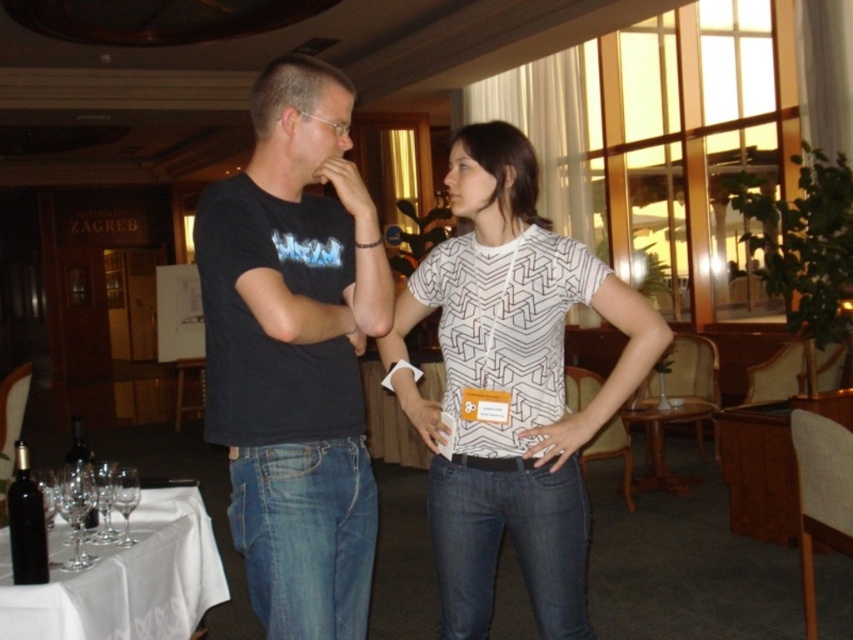
Between black matte t-shirt at center and white geometric shirt at center, which one is positioned lower?

white geometric shirt at center

Who is more distant from viewer, (x=248, y=364) or (x=548, y=436)?

Point (x=548, y=436)

In order to click on black matte t-shirt at center in this screenshot , I will do `click(294, 353)`.